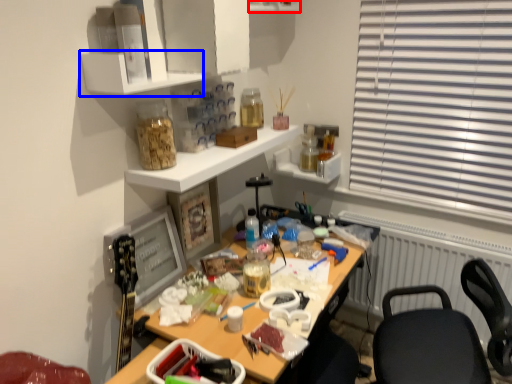
Question: Which object is closer to the camera taking this photo, shelf (highlighted by a red box) or shelf (highlighted by a blue box)?

Choices:
 (A) shelf
 (B) shelf

Answer: (B)